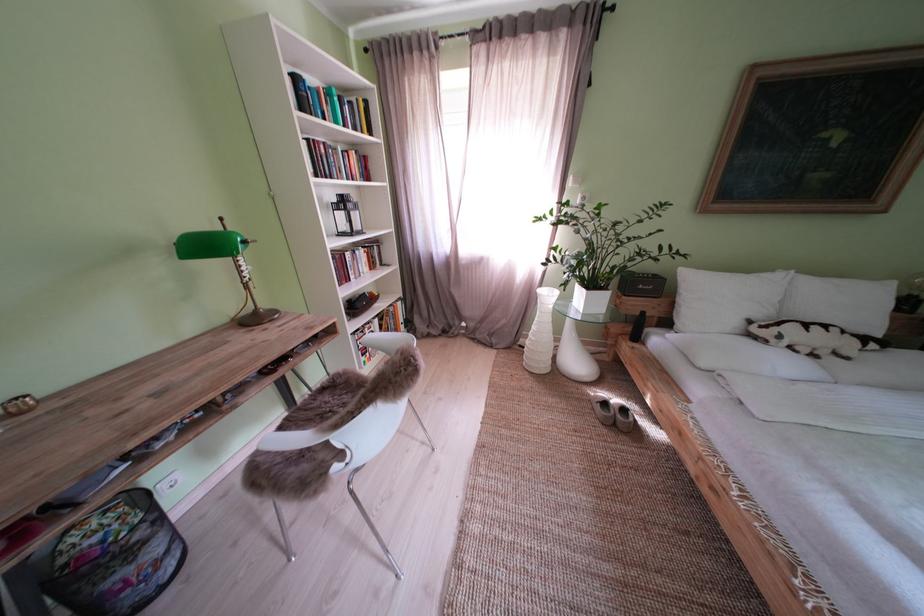
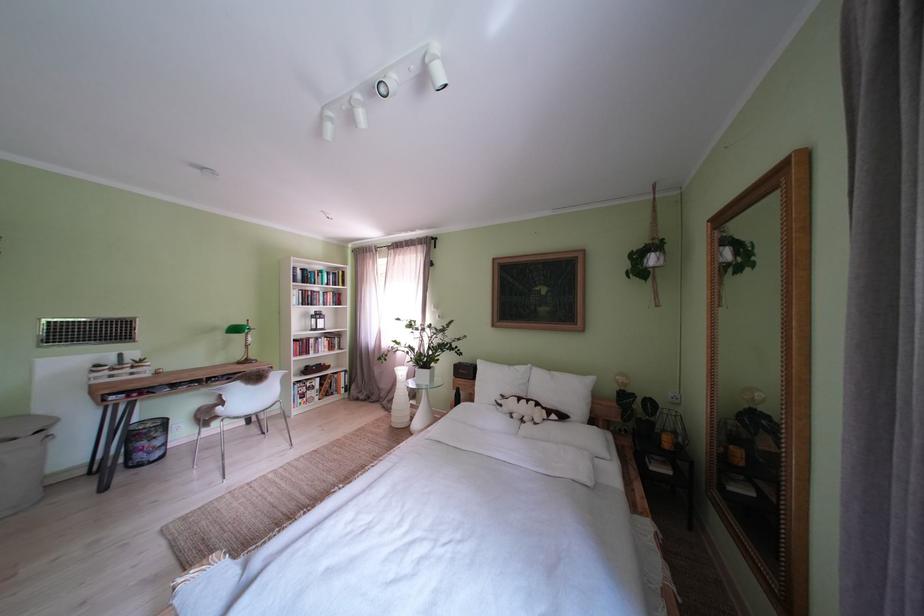
In the second image, find the point that corresponds to (x=723, y=304) in the first image.

(500, 386)